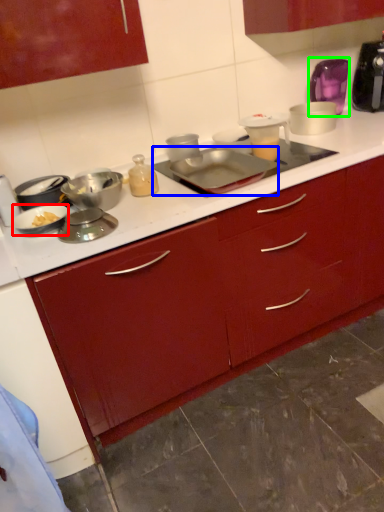
Question: Based on their relative distances, which object is farther from kitchen appliance (highlighted by a red box)? Choose from kitchen appliance (highlighted by a blue box) and appliance (highlighted by a green box).

Choices:
 (A) kitchen appliance
 (B) appliance

Answer: (B)